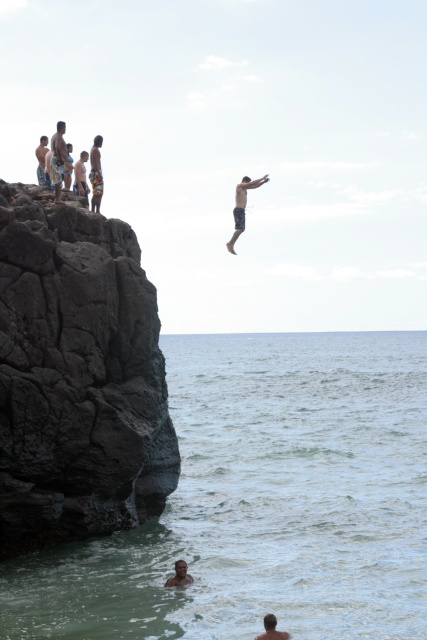
Question: Is dark gray rock at left below tan skin human at upper left?

Choices:
 (A) no
 (B) yes

Answer: (B)

Question: Which object is the closest to the beige textured shorts at left?

Choices:
 (A) skinny black shorts at center
 (B) clear water at cliff edge
 (C) dark gray rock at left
 (D) camouflage shorts at upper left

Answer: (D)

Question: Which point is closer to the camera taking this photo?

Choices:
 (A) (277, 634)
 (B) (98, 189)

Answer: (A)

Question: Which point appears farthest from the camera in this image?

Choices:
 (A) (177, 460)
 (B) (262, 452)
 (C) (181, 573)
 (D) (271, 620)

Answer: (B)

Question: Can you confirm if dark gray rock at left is positioned to the left of tan skin human at upper left?

Choices:
 (A) yes
 (B) no

Answer: (B)

Question: Is beige textured shorts at left smaller than tan skin human at upper left?

Choices:
 (A) no
 (B) yes

Answer: (B)